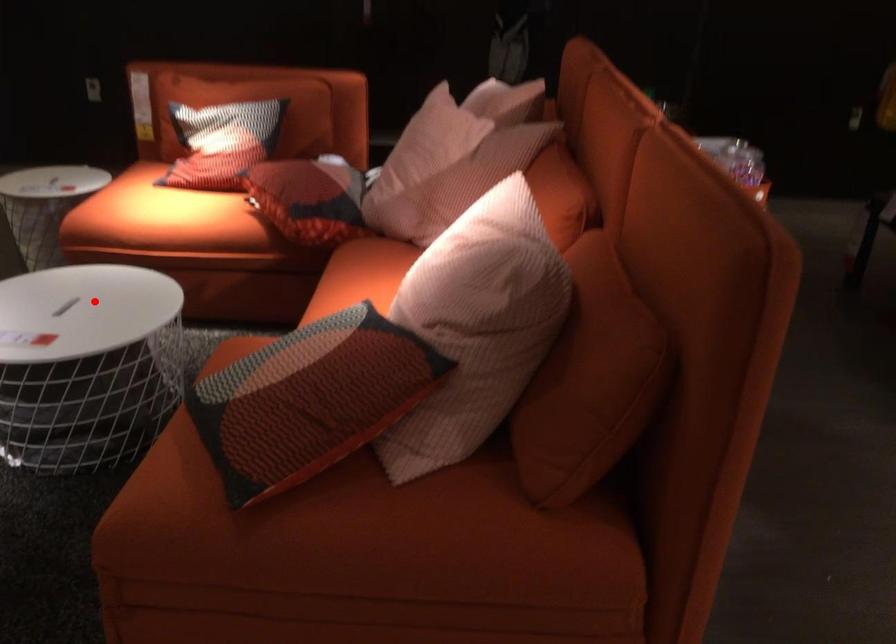
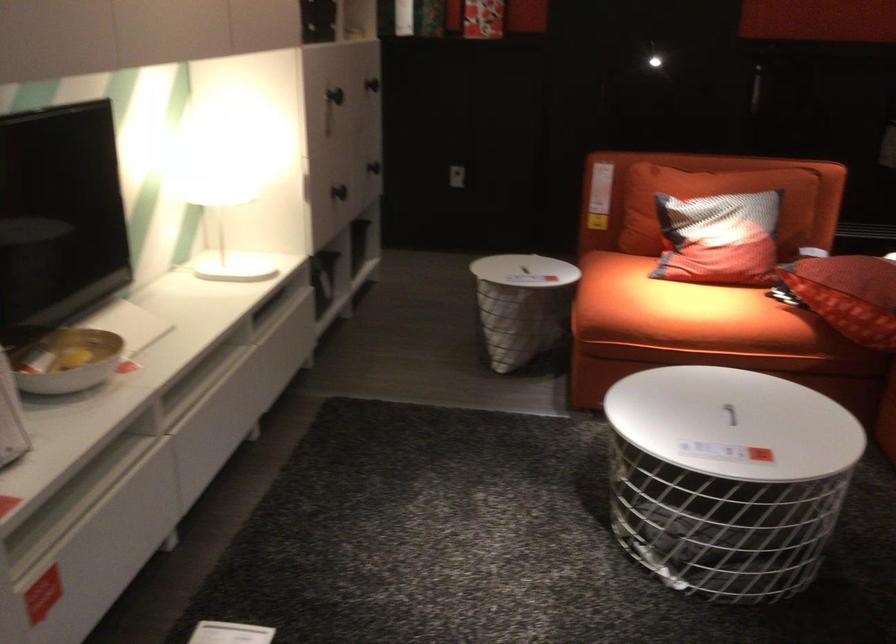
Question: I am providing you with two images of the same scene from different viewpoints. In image1, a red point is highlighted. Considering the same 3D point in image2, which of the following is correct?

Choices:
 (A) It is closer
 (B) It is farther

Answer: (A)